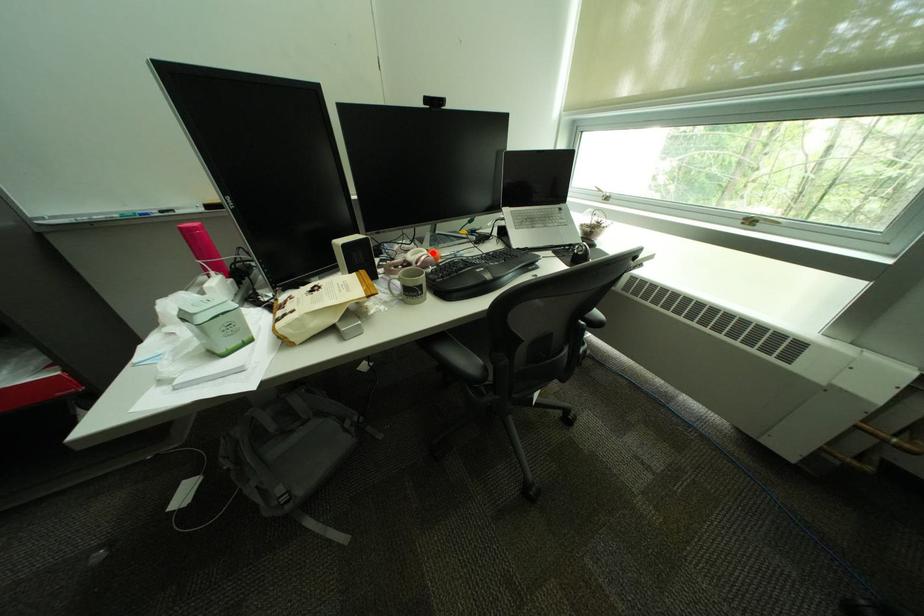
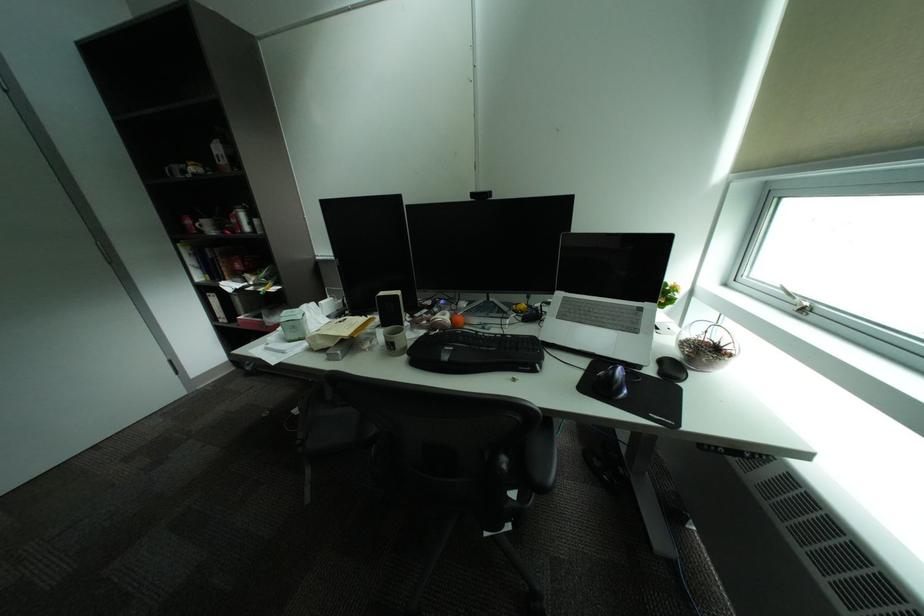
Question: I am providing you with two images of the same scene from different viewpoints. A red point is marked on the first image. Is the red point's position out of view in image 2?

Choices:
 (A) Yes
 (B) No

Answer: (B)